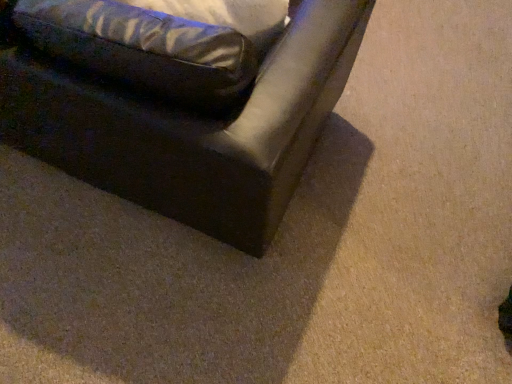
Where is `matte black couch at lower left`? matte black couch at lower left is located at coordinates (194, 130).

What do you see at coordinates (194, 130) in the screenshot? I see `matte black couch at lower left` at bounding box center [194, 130].

Image resolution: width=512 pixels, height=384 pixels. In order to click on matte black couch at lower left in this screenshot , I will do `click(194, 130)`.